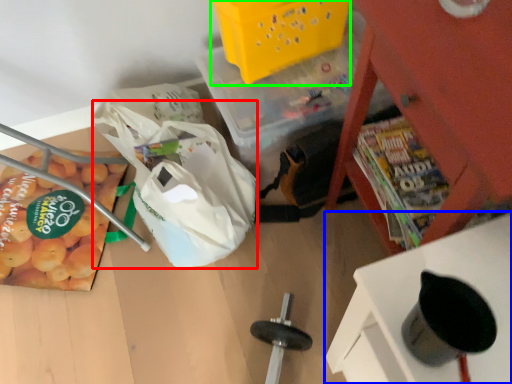
Question: Which is farther away from grocery bag (highlighted by a red box)? furniture (highlighted by a blue box) or basket (highlighted by a green box)?

Choices:
 (A) furniture
 (B) basket

Answer: (A)